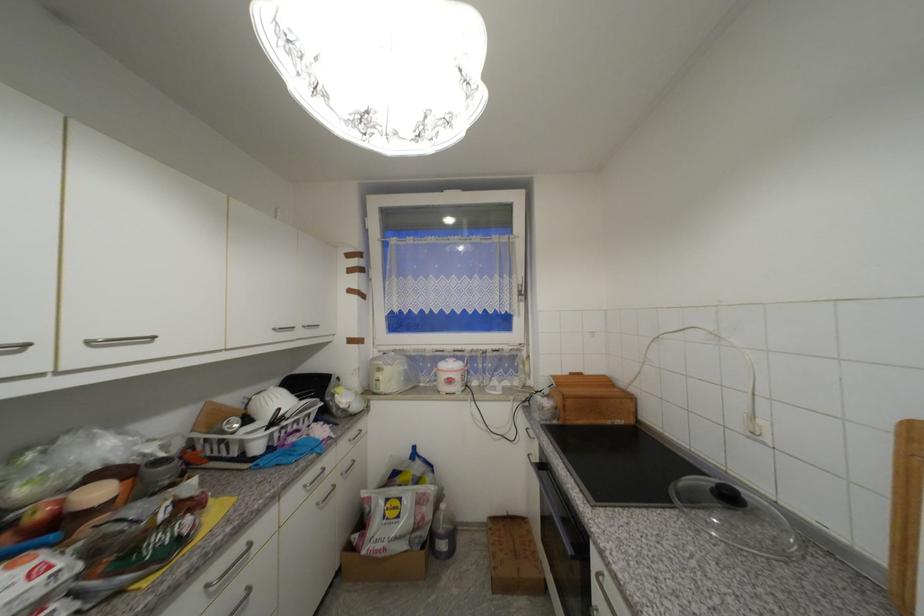
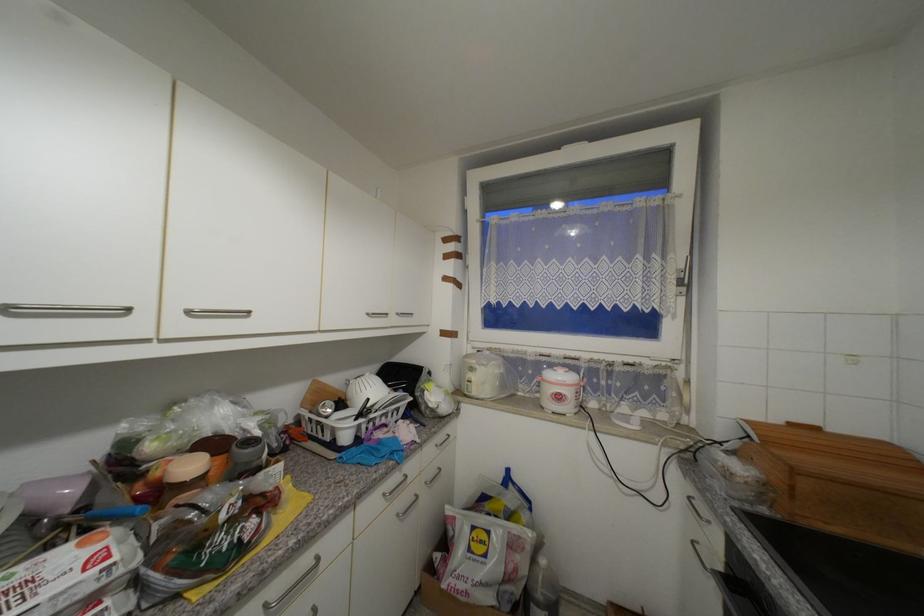
Question: How did the camera likely rotate?

Choices:
 (A) Left
 (B) Right
 (C) Up
 (D) Down

Answer: (A)